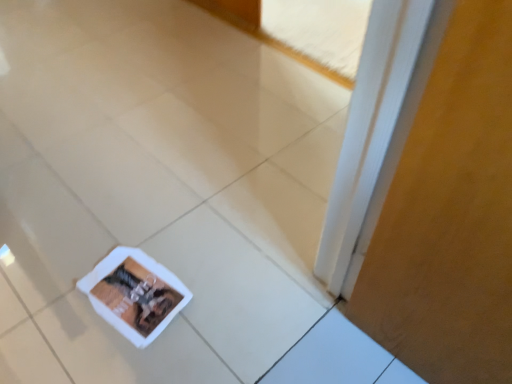
Locate an element on the screen. This screenshot has height=384, width=512. free space to the back side of white glossy magazine at lower left is located at coordinates (165, 233).